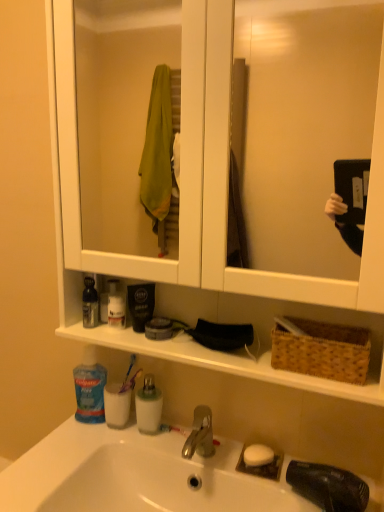
Locate an element on the screen. The width and height of the screenshot is (384, 512). free space that is in between purple plastic toothbrush at lower center and white matte soap at center is located at coordinates (198, 442).